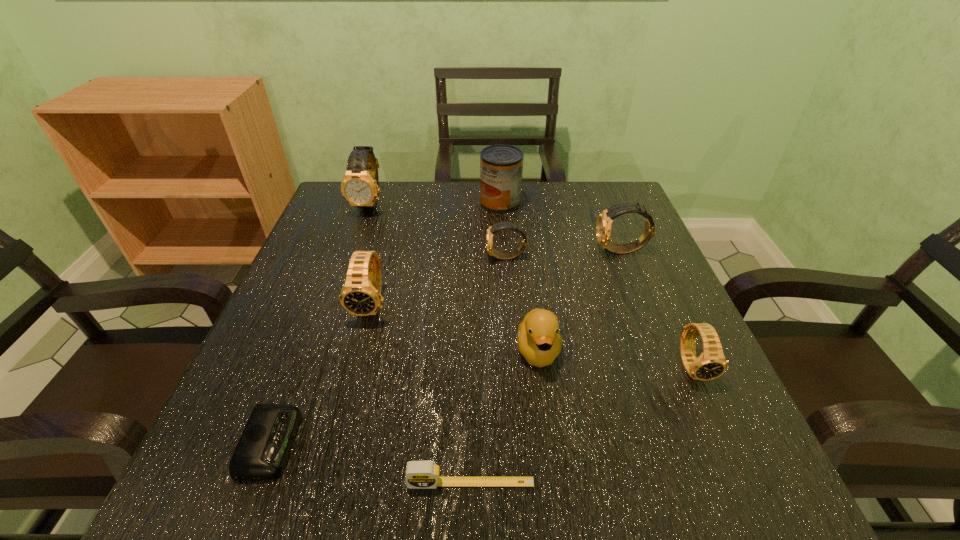
Locate an element on the screen. The height and width of the screenshot is (540, 960). the fourth closest object relative to the alarm clock is located at coordinates (496, 254).

Where is `object that can be found as the eighth closest to the fifth farthest object`? The height and width of the screenshot is (540, 960). object that can be found as the eighth closest to the fifth farthest object is located at coordinates (711, 364).

Where is `the third closest watch to the alarm clock`? the third closest watch to the alarm clock is located at coordinates (360, 187).

The height and width of the screenshot is (540, 960). In order to click on watch that is the closest to the shortest object in this screenshot , I will do `click(361, 294)`.

Identify which gold watch is located as the second nearest to the farthest gold watch. Please provide its 2D coordinates. Your answer should be formatted as a tuple, i.e. [(x, y)], where the tuple contains the x and y coordinates of a point satisfying the conditions above.

[(604, 222)]

Select which gold watch is the second closest to the third watch from left to right. Please provide its 2D coordinates. Your answer should be formatted as a tuple, i.e. [(x, y)], where the tuple contains the x and y coordinates of a point satisfying the conditions above.

[(360, 187)]

The width and height of the screenshot is (960, 540). I want to click on blank area in the image that satisfies the following two spatial constraints: 1. on the face of the red can; 2. on the left side of the biggest gold watch, so point(371,203).

The width and height of the screenshot is (960, 540). I want to click on vacant region that satisfies the following two spatial constraints: 1. on the face of the second gold watch from left to right; 2. at the front of the tape measure with the tape extended, so pyautogui.click(x=523, y=483).